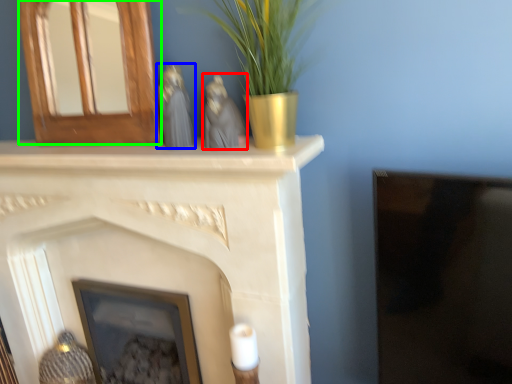
Question: Based on their relative distances, which object is farther from animal (highlighted by a red box)? Choose from animal (highlighted by a blue box) and fireplace (highlighted by a green box).

Choices:
 (A) animal
 (B) fireplace

Answer: (B)